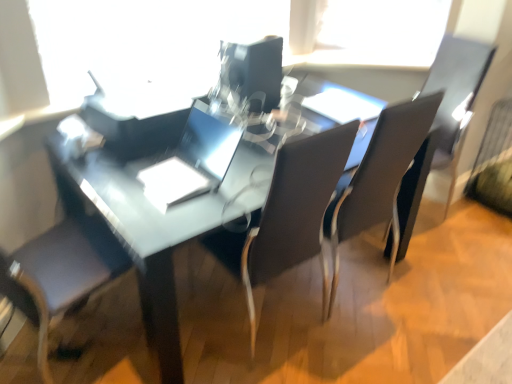
Question: Considering the relative sizes of glossy plastic computer monitor at center and matte black armchair at right in the image provided, is glossy plastic computer monitor at center wider than matte black armchair at right?

Choices:
 (A) yes
 (B) no

Answer: (B)

Question: Is glossy plastic computer monitor at center looking in the opposite direction of matte black armchair at right?

Choices:
 (A) no
 (B) yes

Answer: (A)

Question: Considering the relative positions of glossy plastic computer monitor at center and matte black armchair at right in the image provided, is glossy plastic computer monitor at center to the right of matte black armchair at right from the viewer's perspective?

Choices:
 (A) yes
 (B) no

Answer: (B)

Question: From a real-world perspective, does glossy plastic computer monitor at center sit lower than matte black armchair at right?

Choices:
 (A) no
 (B) yes

Answer: (A)

Question: Does glossy plastic computer monitor at center have a smaller size compared to matte black armchair at right?

Choices:
 (A) no
 (B) yes

Answer: (B)

Question: In terms of height, does matte black chair at center, acting as the 1th chair starting from the right, look taller or shorter compared to transparent plastic window screen at upper center?

Choices:
 (A) short
 (B) tall

Answer: (B)

Question: Would you say matte black chair at center, acting as the 1th chair starting from the right, is to the left or to the right of transparent plastic window screen at upper center in the picture?

Choices:
 (A) left
 (B) right

Answer: (B)

Question: Considering their positions, is matte black chair at center, acting as the 1th chair starting from the right, located in front of or behind transparent plastic window screen at upper center?

Choices:
 (A) behind
 (B) front

Answer: (B)

Question: Would you say matte black chair at center, acting as the 1th chair starting from the right, is inside or outside transparent plastic window screen at upper center?

Choices:
 (A) inside
 (B) outside

Answer: (B)

Question: In the image, is transparent plastic window screen at upper center positioned in front of or behind matte black table at center?

Choices:
 (A) front
 (B) behind

Answer: (B)

Question: From a real-world perspective, is transparent plastic window screen at upper center physically located above or below matte black table at center?

Choices:
 (A) above
 (B) below

Answer: (A)

Question: From the image's perspective, is transparent plastic window screen at upper center positioned above or below matte black table at center?

Choices:
 (A) above
 (B) below

Answer: (A)

Question: In terms of width, does transparent plastic window screen at upper center look wider or thinner when compared to matte black table at center?

Choices:
 (A) wide
 (B) thin

Answer: (B)

Question: Is transparent plastic window screen at upper center to the left or to the right of glossy plastic computer monitor at center in the image?

Choices:
 (A) left
 (B) right

Answer: (A)

Question: Is point (99, 36) closer or farther from the camera than point (248, 69)?

Choices:
 (A) closer
 (B) farther

Answer: (B)